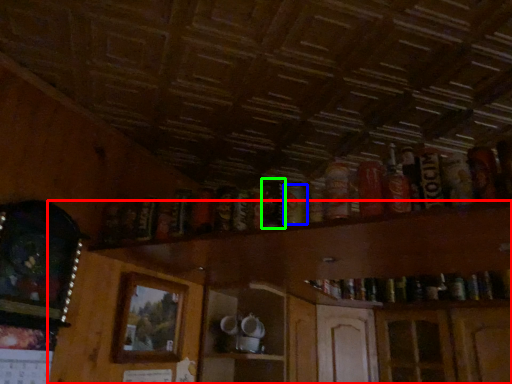
Question: Considering the real-world distances, which object is closest to dresser (highlighted by a red box)? beer (highlighted by a blue box) or beer (highlighted by a green box).

Choices:
 (A) beer
 (B) beer

Answer: (B)